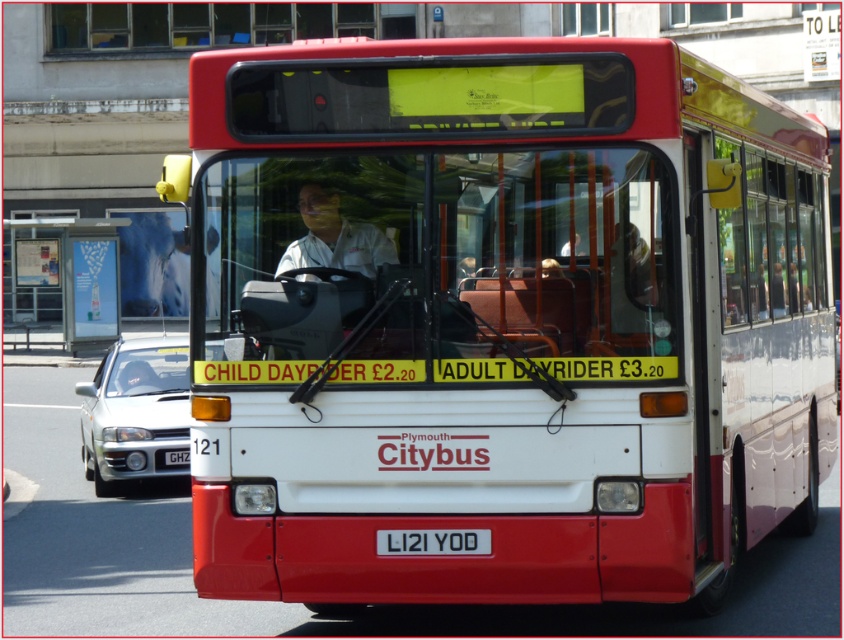
Measure the distance between light beige fabric shirt at center and camera.

light beige fabric shirt at center is 7.23 meters away from camera.

Is light beige fabric shirt at center closer to the viewer compared to white rectangular at center?

That is False.

The width and height of the screenshot is (844, 640). I want to click on light beige fabric shirt at center, so click(x=334, y=237).

Is point (9, 244) positioned behind point (184, 454)?

Yes.

Is point (46, 264) positioned in front of point (182, 456)?

That is False.

The height and width of the screenshot is (640, 844). Find the location of `white plastic bus stop at upper left`. white plastic bus stop at upper left is located at coordinates (61, 280).

Does white glossy sedan at lower left appear under white rectangular at center?

Yes, white glossy sedan at lower left is below white rectangular at center.

Can you confirm if white glossy sedan at lower left is positioned above white rectangular at center?

No.

Does point (120, 436) come behind point (448, 552)?

Yes, point (120, 436) is farther from viewer.

Find the location of `white glossy sedan at lower left`. white glossy sedan at lower left is located at coordinates (134, 412).